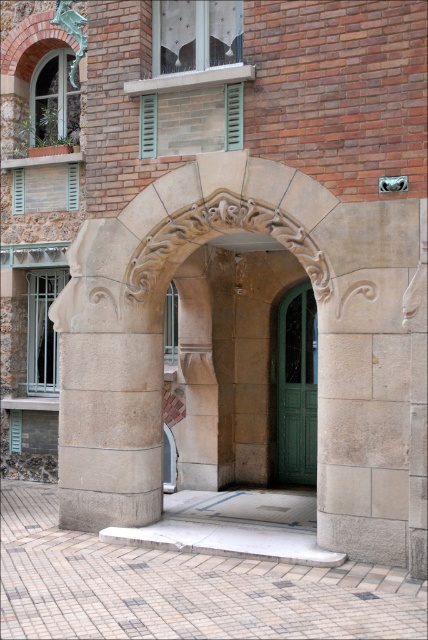
Question: Which point appears closest to the camera in this image?

Choices:
 (A) (45, 170)
 (B) (154, 104)

Answer: (B)

Question: From the image, what is the correct spatial relationship of green patina metal statue at upper left in relation to green painted wood at upper center?

Choices:
 (A) below
 (B) above

Answer: (B)

Question: Where is white plastic shutter at upper left located in relation to green painted wood shutter at upper center in the image?

Choices:
 (A) right
 (B) left

Answer: (B)

Question: Considering the real-world distances, which object is farthest from the green patina metal statue at upper left?

Choices:
 (A) green painted wood shutter at upper center
 (B) green matte door at center
 (C) green painted wood at upper center

Answer: (B)

Question: Can you confirm if green matte door at center is positioned to the left of green patina metal statue at upper left?

Choices:
 (A) no
 (B) yes

Answer: (A)

Question: Which of the following is the closest to the observer?

Choices:
 (A) carved stone arch at center
 (B) green patina metal statue at upper left
 (C) green painted wood shutter at upper center
 (D) green painted wood at upper center

Answer: (A)